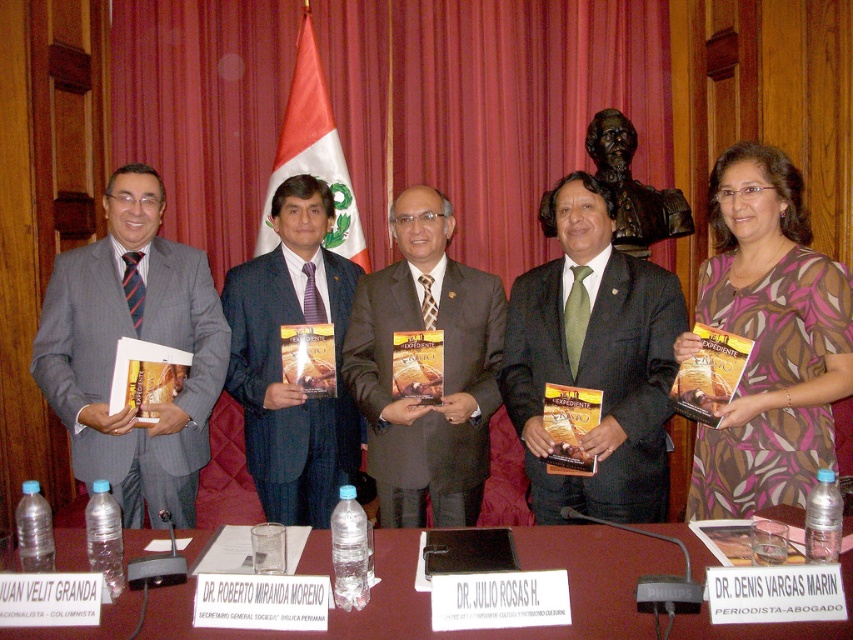
Question: Does patterned fabric dress at center have a smaller size compared to matte brown suit at center?

Choices:
 (A) no
 (B) yes

Answer: (A)

Question: Is dark gray suit at center in front of maroon wood table at center?

Choices:
 (A) yes
 (B) no

Answer: (B)

Question: Which point appears closest to the camera in this image?

Choices:
 (A) (740, 484)
 (B) (241, 403)
 (C) (155, 525)

Answer: (A)

Question: Is maroon wood table at center closer to camera compared to red fabric flag at center?

Choices:
 (A) no
 (B) yes

Answer: (B)

Question: Which point is closer to the camera taking this photo?

Choices:
 (A) (608, 496)
 (B) (337, 460)
 (C) (799, 340)

Answer: (C)

Question: Which is nearer to the gray pinstripe suit at left?

Choices:
 (A) patterned fabric dress at center
 (B) red fabric flag at center

Answer: (B)